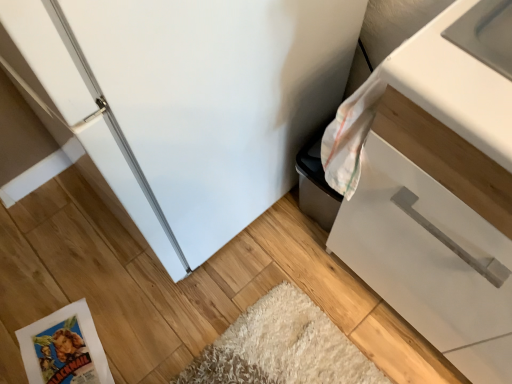
The height and width of the screenshot is (384, 512). I want to click on vacant space to the right of white paper comic book at lower left, so click(x=160, y=329).